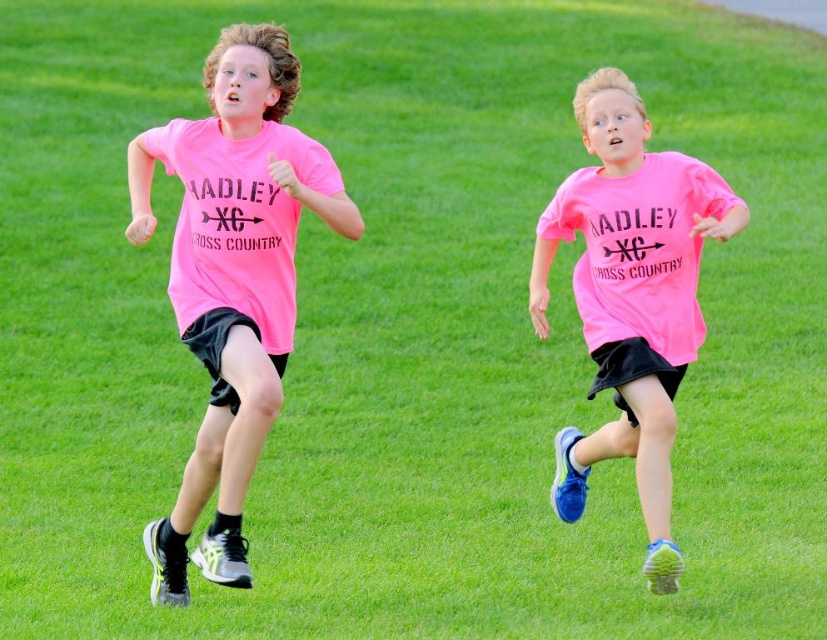
You are a photographer trying to capture both runners wearing pink matte shirts in the image. Since you want to ensure both are in frame, can you tell me which direction the pink matte shirt at left is relative to the pink matte shirt at center?

The pink matte shirt at left is positioned on the left side of the pink matte shirt at center, so to include both in your photo, aim the camera towards the left of the pink matte shirt at center to capture the pink matte shirt at left alongside it.

You are a photographer standing behind the two boys in the grassy field. You want to take a picture that includes both the pink matte shirt at left and the pink matte shirt at center. Which shirt will appear larger in your photo?

The pink matte shirt at left will appear larger in the photo because it is closer to the viewer than the pink matte shirt at center.

You are a photographer trying to capture both boys in a single shot. Given that your camera can only focus on objects wider than 10cm, can both the pink matte shirt at left and pink matte shirt at center be in focus if the shirt at left is wider than the one at center?

The pink matte shirt at left is wider than the pink matte shirt at center. Since the camera requires objects wider than 10cm to be in focus, and the shirt at left is wider, it will be in focus. However, the shirt at center may not be if its width is under 10cm. But since the description only states the left shirt is wider, we cannot confirm the center shirt meets the 10cm requirement.